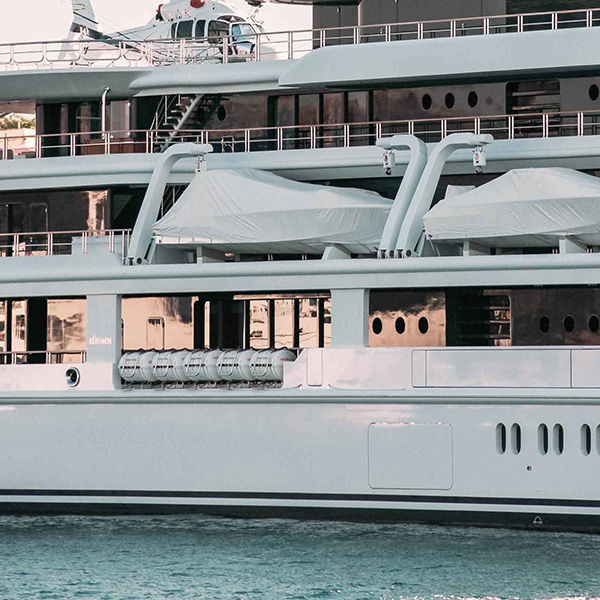
Where is `stairwell`? This screenshot has width=600, height=600. stairwell is located at coordinates (172, 127).